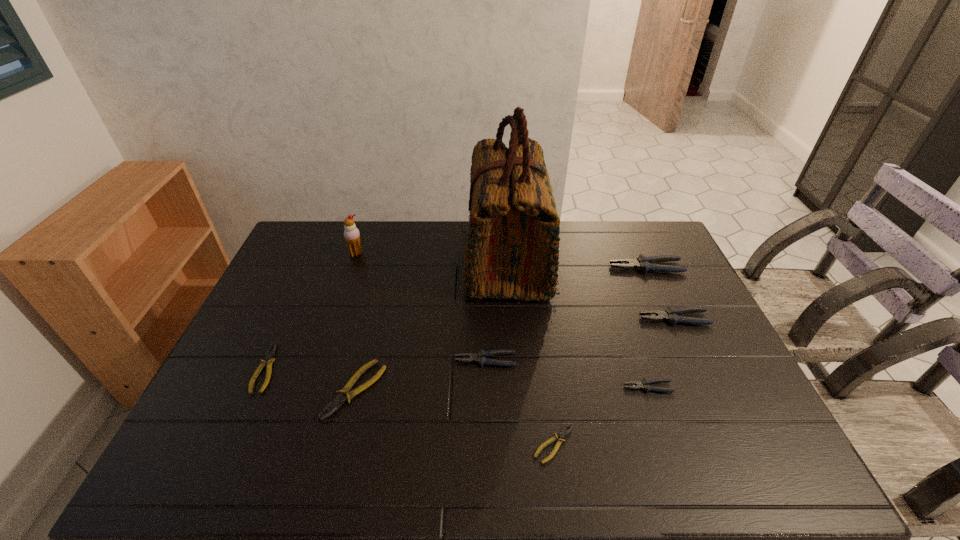
I want to click on vacant space located at the gripping part of the third tallest object, so click(494, 267).

This screenshot has height=540, width=960. What are the coordinates of `blank space located at the gripping part of the third tallest object` in the screenshot? It's located at (549, 267).

This screenshot has height=540, width=960. I want to click on vacant space located 0.060m at the gripping part of the third tallest object, so click(x=592, y=267).

Find the location of a particular element. The image size is (960, 540). vacant space located at the gripping part of the third smallest gray pliers is located at coordinates (587, 319).

The width and height of the screenshot is (960, 540). Find the location of `free region located at the gripping part of the third smallest gray pliers`. free region located at the gripping part of the third smallest gray pliers is located at coordinates (508, 319).

Image resolution: width=960 pixels, height=540 pixels. What are the coordinates of `free location located 0.080m at the gripping part of the third smallest gray pliers` in the screenshot? It's located at (613, 319).

Find the location of `free space located 0.170m at the gripping part of the third tallest pliers`. free space located 0.170m at the gripping part of the third tallest pliers is located at coordinates (394, 360).

The image size is (960, 540). Find the location of `free region located at the gripping part of the third tallest pliers`. free region located at the gripping part of the third tallest pliers is located at coordinates (357, 360).

The image size is (960, 540). Identify the location of vacant space situated at the gripping part of the third tallest pliers. (412, 360).

Locate an element on the screen. The width and height of the screenshot is (960, 540). free region located on the back of the second yellow pliers from right to left is located at coordinates (374, 312).